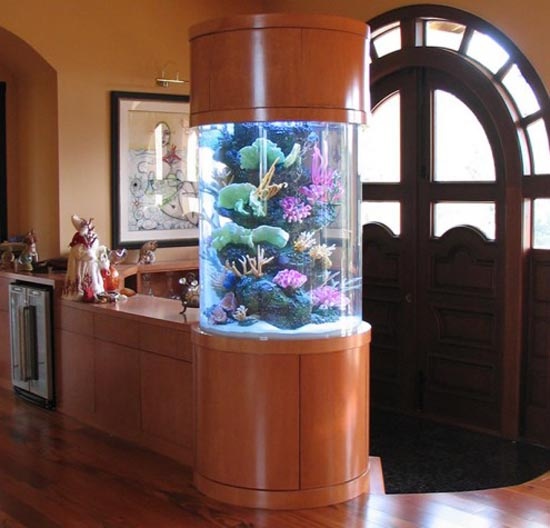
At what (x,y) coordinates should I click in order to perform the action: click on wooden floor. Please return your answer as a coordinate pair (x, y). This screenshot has width=550, height=528. Looking at the image, I should click on (65, 485).